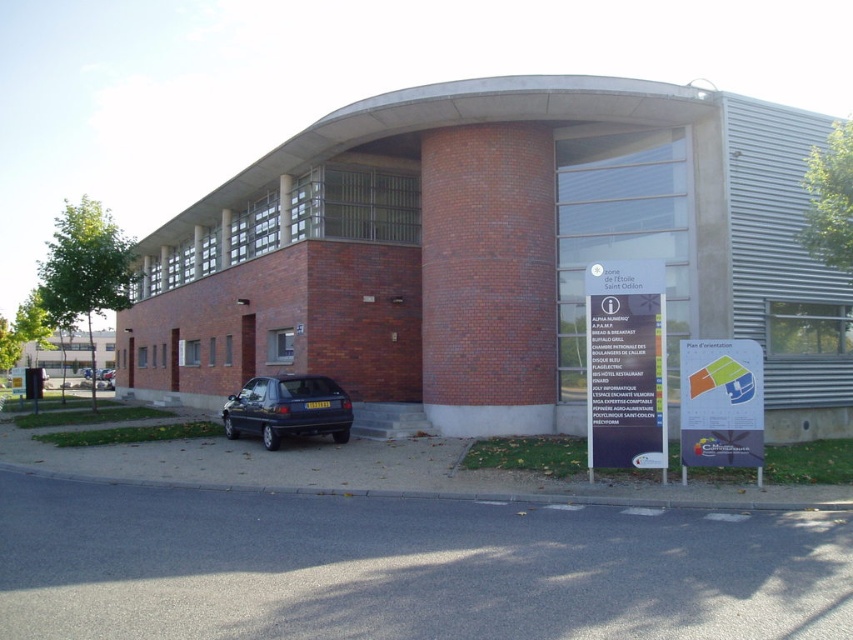
You are a delivery driver who needs to park your truck, which is 30 feet long, in the space between the brick building at center and the white plastic sign at lower right. Can your truck fit in that space?

The distance between the brick building at center and the white plastic sign at lower right is 33.37 feet, which is longer than the truck length of 30 feet. Therefore, the truck can fit in that space.